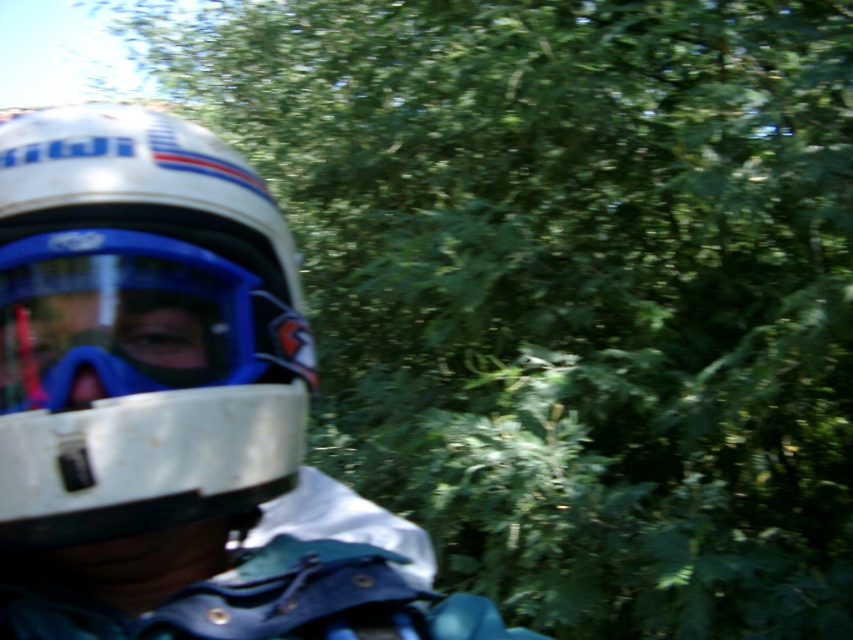
You are a drone operator trying to navigate between two points in the scene. The first point is point [51,243] and the second point is point [119,264]. Which point is closer to the camera?

Point [51,243] is in front of point [119,264], so it is closer to the camera.